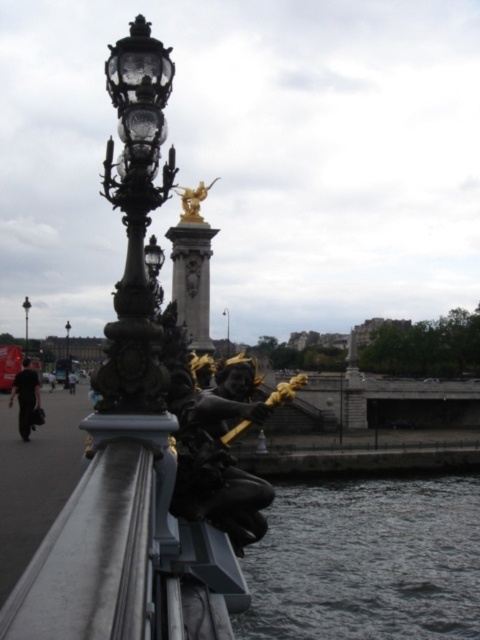
Question: Which object is the closest to the black polished street light at upper left?

Choices:
 (A) matte black street light at upper left
 (B) dark gray water at lower center
 (C) black polished statue at center

Answer: (A)

Question: Can you confirm if black polished street light at upper left is bigger than matte black street light at upper left?

Choices:
 (A) no
 (B) yes

Answer: (A)

Question: Which object is farther from the camera taking this photo?

Choices:
 (A) black polished statue at center
 (B) white marble column at center
 (C) black polished street light at upper left
 (D) matte black street light at upper left

Answer: (D)

Question: Is black polished street light at upper left smaller than black glass street light at center?

Choices:
 (A) yes
 (B) no

Answer: (B)

Question: Which is nearer to the gold polished statue at upper center?

Choices:
 (A) black glass street light at center
 (B) black polished statue at center

Answer: (B)

Question: Is the position of dark gray water at lower center more distant than that of gold polished statue at upper center?

Choices:
 (A) no
 (B) yes

Answer: (B)